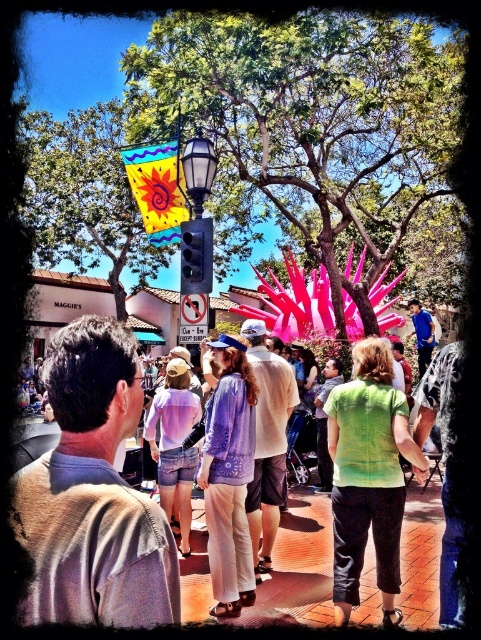
Question: Which point is closer to the camera?

Choices:
 (A) metallic traffic light at center
 (B) matte black lamp post at center
 (C) pastel tie-dye shirt at center

Answer: (C)

Question: Is pastel tie-dye shirt at center below metallic traffic light at center?

Choices:
 (A) yes
 (B) no

Answer: (A)

Question: Is the position of matte black lamp post at center less distant than that of metallic traffic light at center?

Choices:
 (A) yes
 (B) no

Answer: (B)

Question: Can you confirm if pastel tie-dye shirt at center is bigger than metallic traffic light at center?

Choices:
 (A) yes
 (B) no

Answer: (A)

Question: Which point appears closest to the camera in this image?

Choices:
 (A) (41, 529)
 (B) (205, 228)
 (C) (189, 179)

Answer: (A)

Question: Which point appears farthest from the camera in this image?

Choices:
 (A) (180, 273)
 (B) (128, 428)

Answer: (A)